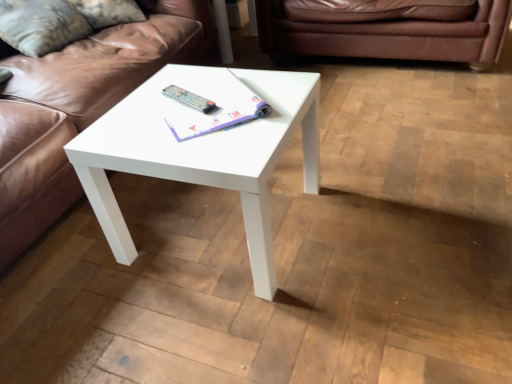
Where is `vacant area that is in front of silver metallic remote at center`? The height and width of the screenshot is (384, 512). vacant area that is in front of silver metallic remote at center is located at coordinates point(190,120).